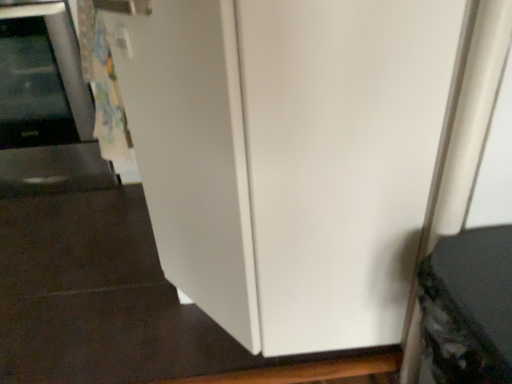
Question: Is textured gray fabric at lower right, arranged as the first appliance when viewed from the front, thinner than satin silver microwave at left, the 1th appliance from the left?

Choices:
 (A) yes
 (B) no

Answer: (A)

Question: Is textured gray fabric at lower right, arranged as the first appliance when viewed from the front, looking in the opposite direction of satin silver microwave at left, the second appliance when ordered from front to back?

Choices:
 (A) no
 (B) yes

Answer: (A)

Question: Is textured gray fabric at lower right, the first appliance from the right, smaller than satin silver microwave at left, which is counted as the first appliance, starting from the back?

Choices:
 (A) no
 (B) yes

Answer: (B)

Question: Does textured gray fabric at lower right, which ranks as the second appliance in top-to-bottom order, turn towards satin silver microwave at left, which is the 2th appliance in right-to-left order?

Choices:
 (A) no
 (B) yes

Answer: (A)

Question: Does textured gray fabric at lower right, which ranks as the second appliance in top-to-bottom order, appear on the left side of satin silver microwave at left, which is the 2th appliance in right-to-left order?

Choices:
 (A) yes
 (B) no

Answer: (B)

Question: Considering the relative sizes of textured gray fabric at lower right, which ranks as the second appliance in top-to-bottom order, and satin silver microwave at left, the second appliance ordered from the bottom, in the image provided, is textured gray fabric at lower right, which ranks as the second appliance in top-to-bottom order, bigger than satin silver microwave at left, the second appliance ordered from the bottom,?

Choices:
 (A) no
 (B) yes

Answer: (A)

Question: Does satin silver microwave at left, which is counted as the first appliance, starting from the back, have a greater width compared to textured gray fabric at lower right, which ranks as the second appliance in top-to-bottom order?

Choices:
 (A) yes
 (B) no

Answer: (A)

Question: From a real-world perspective, is satin silver microwave at left, acting as the first appliance starting from the top, physically below textured gray fabric at lower right, the 2th appliance in the left-to-right sequence?

Choices:
 (A) no
 (B) yes

Answer: (A)

Question: Is satin silver microwave at left, the 1th appliance from the left, turned away from textured gray fabric at lower right, which ranks as the second appliance in top-to-bottom order?

Choices:
 (A) yes
 (B) no

Answer: (B)

Question: Is satin silver microwave at left, which is the 2th appliance in right-to-left order, not close to textured gray fabric at lower right, which is the first appliance from bottom to top?

Choices:
 (A) yes
 (B) no

Answer: (A)

Question: Can you confirm if satin silver microwave at left, which is counted as the first appliance, starting from the back, is taller than textured gray fabric at lower right, which ranks as the second appliance in top-to-bottom order?

Choices:
 (A) yes
 (B) no

Answer: (A)

Question: Is satin silver microwave at left, acting as the first appliance starting from the top, in front of textured gray fabric at lower right, the first appliance from the right?

Choices:
 (A) no
 (B) yes

Answer: (A)

Question: Is satin silver microwave at left, which is the 2th appliance in right-to-left order, wider or thinner than textured gray fabric at lower right, which is the first appliance from bottom to top?

Choices:
 (A) wide
 (B) thin

Answer: (A)